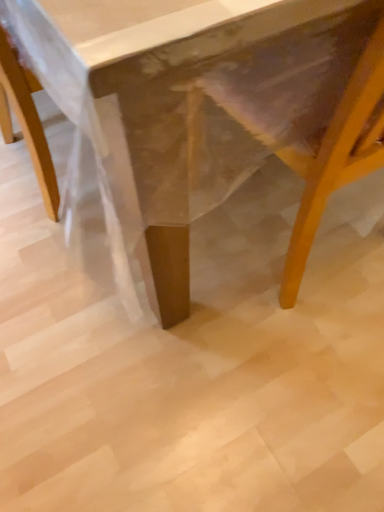
Question: Does wooden swivel chair at lower right have a lesser width compared to wooden table at center?

Choices:
 (A) yes
 (B) no

Answer: (A)

Question: Is wooden swivel chair at lower right placed right next to wooden table at center?

Choices:
 (A) yes
 (B) no

Answer: (A)

Question: Is wooden swivel chair at lower right positioned beyond the bounds of wooden table at center?

Choices:
 (A) yes
 (B) no

Answer: (B)

Question: Considering the relative sizes of wooden swivel chair at lower right and wooden table at center in the image provided, is wooden swivel chair at lower right taller than wooden table at center?

Choices:
 (A) no
 (B) yes

Answer: (A)

Question: From a real-world perspective, is wooden swivel chair at lower right under wooden table at center?

Choices:
 (A) no
 (B) yes

Answer: (B)

Question: Is wooden swivel chair at lower right looking in the opposite direction of wooden table at center?

Choices:
 (A) no
 (B) yes

Answer: (B)

Question: From the image's perspective, is wooden table at center below wooden swivel chair at lower right?

Choices:
 (A) yes
 (B) no

Answer: (B)

Question: Is wooden table at center oriented towards wooden swivel chair at lower right?

Choices:
 (A) no
 (B) yes

Answer: (A)

Question: Can you confirm if wooden table at center is wider than wooden swivel chair at lower right?

Choices:
 (A) yes
 (B) no

Answer: (A)

Question: Is wooden table at center facing away from wooden swivel chair at lower right?

Choices:
 (A) yes
 (B) no

Answer: (B)

Question: Is wooden table at center outside wooden swivel chair at lower right?

Choices:
 (A) no
 (B) yes

Answer: (B)

Question: Can you confirm if wooden table at center is positioned to the left of wooden swivel chair at lower right?

Choices:
 (A) no
 (B) yes

Answer: (B)

Question: In the image, is wooden swivel chair at lower right positioned in front of or behind wooden table at center?

Choices:
 (A) behind
 (B) front

Answer: (A)